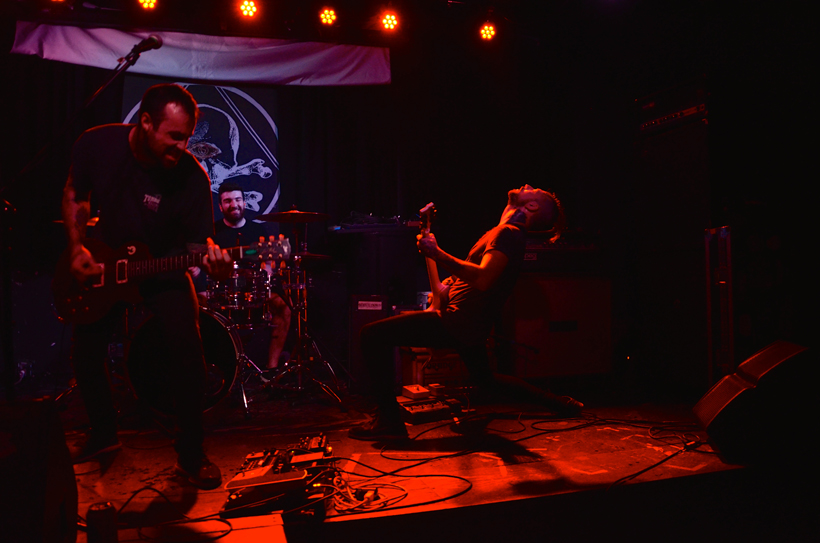
Find the location of a particular element. The image size is (820, 543). backdrop is located at coordinates (225, 154).